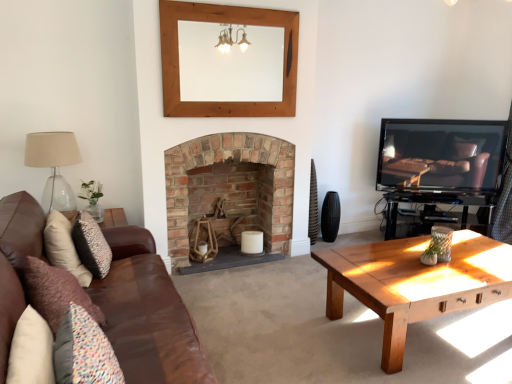
Find the location of a particular element. translucent glass lampshade at left is located at coordinates (54, 165).

At what (x,y) coordinates should I click in order to perform the action: click on wooden mirror at upper center. Please return your answer as a coordinate pair (x, y). Looking at the image, I should click on (230, 65).

Identify the location of velvet floral pillow at left, which is the first pillow from left to right. The image size is (512, 384). (64, 247).

Identify the location of matte black tv at right. (441, 154).

What do you see at coordinates (441, 154) in the screenshot?
I see `matte black tv at right` at bounding box center [441, 154].

Identify the location of translucent glass lampshade at left. This screenshot has width=512, height=384. (54, 165).

Consider the image. How much distance is there between brown leather couch at center and black matte speaker at center?

brown leather couch at center is 2.42 meters from black matte speaker at center.

From the image's perspective, is brown leather couch at center on top of black matte speaker at center?

No, from the image's perspective, brown leather couch at center is not above black matte speaker at center.

Between brown leather couch at center and black matte speaker at center, which one has smaller size?

With smaller size is black matte speaker at center.

Is brown leather couch at center further to the viewer compared to black matte speaker at center?

No, brown leather couch at center is in front of black matte speaker at center.

Is rustic brick fireplace at center a part of wooden mirror at upper center?

That's incorrect, rustic brick fireplace at center is not inside wooden mirror at upper center.

Considering the points (251, 26) and (197, 150), which point is in front, point (251, 26) or point (197, 150)?

The point (251, 26) is in front.

Is wooden mirror at upper center far away from rustic brick fireplace at center?

They are positioned close to each other.

From the image's perspective, is wooden mirror at upper center above or below rustic brick fireplace at center?

From the image's perspective, wooden mirror at upper center appears above rustic brick fireplace at center.

At what (x,y) coordinates should I click in order to perform the action: click on speaker on the right of multicolored fabric pillow at lower left, arranged as the 2th pillow when viewed from the back. Please return your answer as a coordinate pair (x, y). The width and height of the screenshot is (512, 384). Looking at the image, I should click on (330, 216).

How different are the orientations of black matte speaker at center and multicolored fabric pillow at lower left, arranged as the 2th pillow when viewed from the back, in degrees?

94.2 degrees.

Considering the relative sizes of black matte speaker at center and multicolored fabric pillow at lower left, arranged as the 2th pillow when viewed from the back, in the image provided, is black matte speaker at center wider than multicolored fabric pillow at lower left, arranged as the 2th pillow when viewed from the back,?

No.

From the image's perspective, is black matte speaker at center under multicolored fabric pillow at lower left, arranged as the 2th pillow when viewed from the back?

No.

Is velvet floral pillow at left, acting as the 3th pillow starting from the front, surrounded by wooden mirror at upper center?

That's incorrect, velvet floral pillow at left, acting as the 3th pillow starting from the front, is not inside wooden mirror at upper center.

Locate an element on the screen. the 1st pillow in front of the wooden mirror at upper center, starting your count from the anchor is located at coordinates (64, 247).

Considering the sizes of objects wooden mirror at upper center and velvet floral pillow at left, which is the first pillow from left to right, in the image provided, who is wider, wooden mirror at upper center or velvet floral pillow at left, which is the first pillow from left to right,?

Wider between the two is velvet floral pillow at left, which is the first pillow from left to right.

From the image's perspective, is translucent glass lampshade at left below matte black tv at right?

Yes.

From a real-world perspective, is translucent glass lampshade at left below matte black tv at right?

No, from a real-world perspective, translucent glass lampshade at left is not beneath matte black tv at right.

Is point (34, 134) positioned after point (383, 142)?

No, it is not.

Who is taller, translucent glass lampshade at left or matte black tv at right?

matte black tv at right is taller.

Is point (333, 218) closer or farther from the camera than point (426, 162)?

Point (333, 218) is farther from the camera than point (426, 162).

Find the location of a particular element. This screenshot has width=512, height=384. television on the right of black matte speaker at center is located at coordinates (441, 154).

Does black matte speaker at center appear on the right side of matte black tv at right?

In fact, black matte speaker at center is to the left of matte black tv at right.

Based on the photo, is black matte speaker at center oriented towards matte black tv at right?

No, black matte speaker at center does not turn towards matte black tv at right.

Can you confirm if matte black tv at right is bigger than black matte speaker at center?

Yes, matte black tv at right is bigger than black matte speaker at center.

Measure the distance from matte black tv at right to black matte speaker at center.

They are 3.42 feet apart.

Where is `television in front of the black matte speaker at center`? The width and height of the screenshot is (512, 384). television in front of the black matte speaker at center is located at coordinates (441, 154).

Does matte black tv at right have a greater width compared to black matte speaker at center?

Yes, matte black tv at right is wider than black matte speaker at center.

What are the coordinates of `studio couch on the left side of black matte speaker at center` in the screenshot? It's located at (147, 314).

You are a GUI agent. You are given a task and a screenshot of the screen. Output one action in this format:
    pyautogui.click(x=<x>, y=<y>)
    Task: Click on the mirror in front of the rustic brick fireplace at center
    
    Given the screenshot: What is the action you would take?
    pyautogui.click(x=230, y=65)

From the image, which object appears to be nearer to matte black tv at right, multicolored fabric pillow at lower left, arranged as the 2th pillow when viewed from the back, or velvet purple pillow at left, which is the 1th pillow from front to back?

velvet purple pillow at left, which is the 1th pillow from front to back, is closer to matte black tv at right.

Which object lies nearer to the anchor point translucent glass lampshade at left, velvet purple pillow at left, which is the 1th pillow from front to back, or rustic brick fireplace at center?

Among the two, rustic brick fireplace at center is located nearer to translucent glass lampshade at left.

Which object lies nearer to the anchor point matte black tv at right, velvet purple pillow at left, which is the 1th pillow from front to back, or multicolored fabric pillow at lower left, which is the third pillow from left to right?

velvet purple pillow at left, which is the 1th pillow from front to back, is positioned closer to the anchor matte black tv at right.

Based on their spatial positions, is matte black tv at right or wooden mirror at upper center closer to brown leather couch at center?

wooden mirror at upper center is closer to brown leather couch at center.

From the picture: Estimate the real-world distances between objects in this image. Which object is closer to brown leather couch at center, black matte speaker at center or multicolored fabric pillow at lower left, which is the 2th pillow from front to back?

multicolored fabric pillow at lower left, which is the 2th pillow from front to back.

Estimate the real-world distances between objects in this image. Which object is further from velvet floral pillow at left, placed as the third pillow when sorted from right to left, multicolored fabric pillow at lower left, which is the 2th pillow from front to back, or velvet purple pillow at left, the 2th pillow positioned from the right?

multicolored fabric pillow at lower left, which is the 2th pillow from front to back, is further to velvet floral pillow at left, placed as the third pillow when sorted from right to left.

Based on their spatial positions, is velvet floral pillow at left, placed as the third pillow when sorted from right to left, or wooden mirror at upper center closer to brown leather couch at center?

velvet floral pillow at left, placed as the third pillow when sorted from right to left, is closer to brown leather couch at center.

Based on their spatial positions, is velvet floral pillow at left, placed as the third pillow when sorted from right to left, or translucent glass lampshade at left further from rustic brick fireplace at center?

velvet floral pillow at left, placed as the third pillow when sorted from right to left.

I want to click on mirror located between multicolored fabric pillow at lower left, positioned as the 1th pillow in right-to-left order, and rustic brick fireplace at center in the depth direction, so click(230, 65).

This screenshot has width=512, height=384. What are the coordinates of `mirror between velvet floral pillow at left, which is the first pillow from left to right, and matte black tv at right from left to right` in the screenshot? It's located at (230, 65).

Identify the location of television between velvet purple pillow at left, which is the 1th pillow from front to back, and black matte speaker at center in the front-back direction. This screenshot has width=512, height=384. (441, 154).

Find the location of a particular element. mirror located between velvet purple pillow at left, which is the 1th pillow from front to back, and black matte speaker at center in the depth direction is located at coordinates (230, 65).